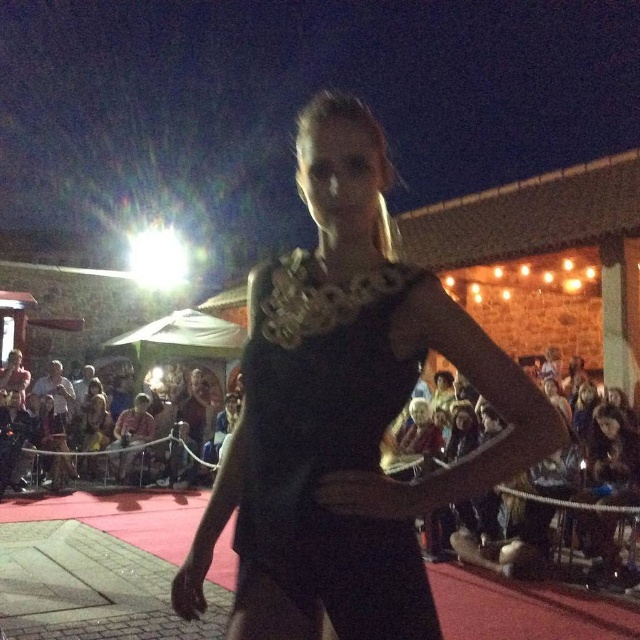
Question: Which object is closer to the camera taking this photo?

Choices:
 (A) black satin dress at center
 (B) light brown fabric hat at lower center
 (C) black matte dress at center

Answer: (C)

Question: Among these points, which one is farthest from the camera?

Choices:
 (A) (131, 449)
 (B) (259, 426)
 (C) (360, 566)

Answer: (A)

Question: Can you confirm if black matte dress at center is positioned above black satin dress at center?

Choices:
 (A) yes
 (B) no

Answer: (A)

Question: Based on their relative distances, which object is nearer to the light brown fabric hat at lower center?

Choices:
 (A) black satin dress at center
 (B) black matte dress at center

Answer: (B)

Question: Does black satin dress at center have a lesser width compared to light brown fabric hat at lower center?

Choices:
 (A) no
 (B) yes

Answer: (B)

Question: Can you confirm if black satin dress at center is smaller than light brown fabric hat at lower center?

Choices:
 (A) yes
 (B) no

Answer: (A)